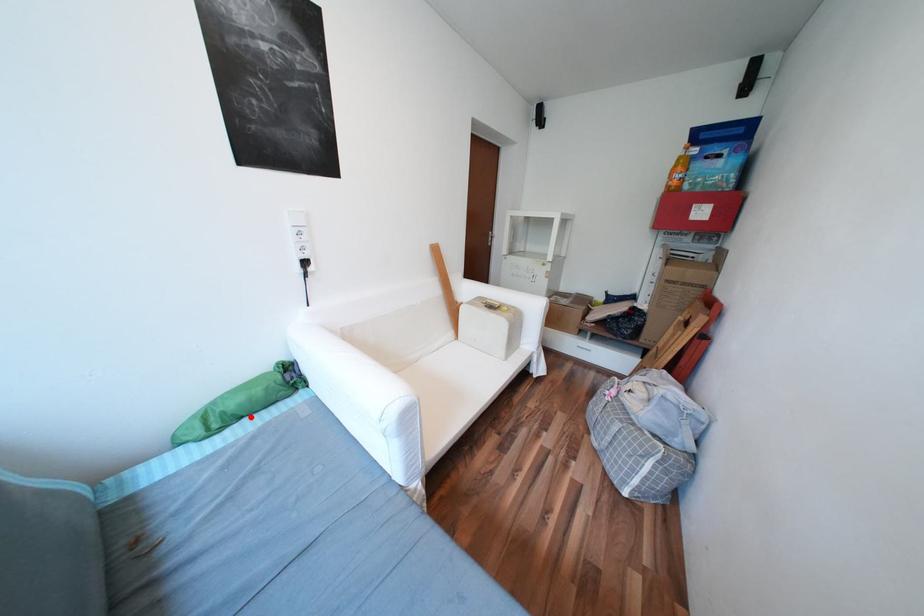
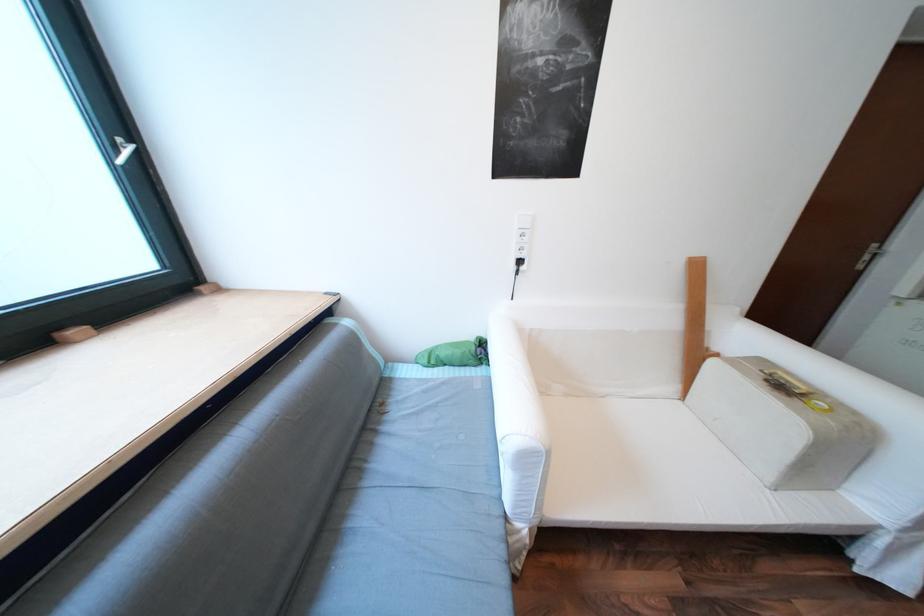
The point at the highlighted location is marked in the first image. Where is the corresponding point in the second image?

(455, 365)